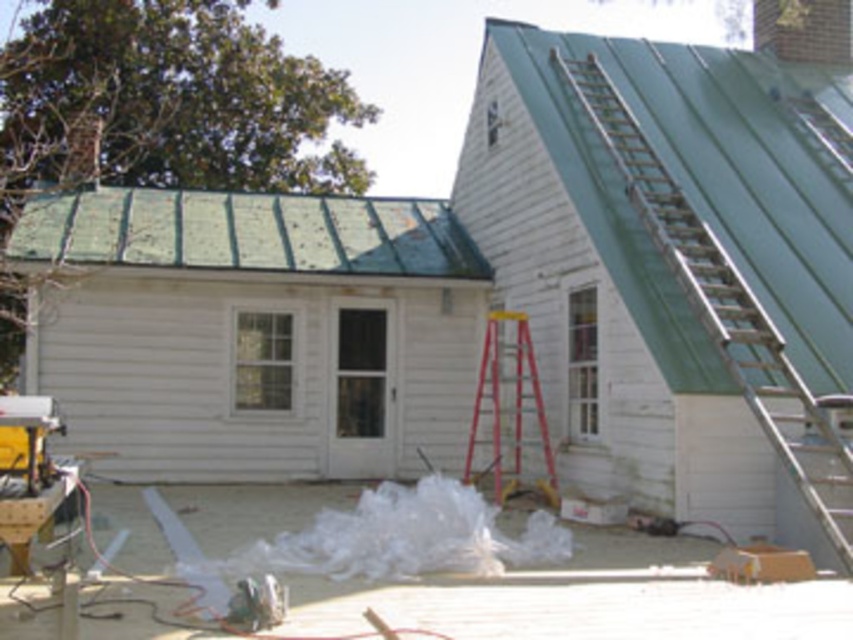
You are a construction worker needing to access the roof of the house. You see the metallic silver ladder at upper right and the red plastic ladder at center. Which ladder should you use to reach the roof safely?

The metallic silver ladder at upper right is closer to the viewer than the red plastic ladder at center, so you should use the metallic silver ladder at upper right to reach the roof safely as it is positioned nearer to the access point.

You are a construction worker needing to place a 1.2 meter wide tool box between the metallic silver ladder at upper right and the brick chimney at upper right. Based on the scene, will the space between them be sufficient?

The metallic silver ladder at upper right has a lesser width compared to brick chimney at upper right, but the description does not provide the exact distance between them. Therefore, it is uncertain if the 1.2 meter wide tool box will fit.

You are a construction worker who needs to move from the red ladder standing upright near the base of the house to the metallic silver ladder at upper right. The safety regulations state that you must stay within 9 meters of each other to ensure safety. Can you safely move between them?

The distance between the red ladder standing upright near the base of the house and the metallic silver ladder at upper right is 8.85 meters, which is within the 9 meters safety regulation. Therefore, you can safely move between them.